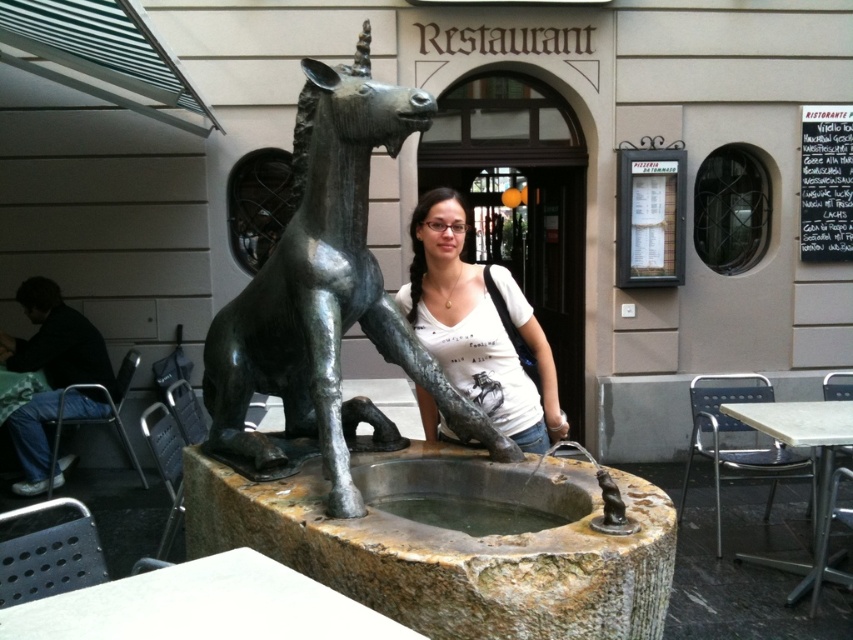
Question: Which point is closer to the camera?

Choices:
 (A) (445, 246)
 (B) (79, 408)

Answer: (A)

Question: Estimate the real-world distances between objects in this image. Which object is closer to the dark blue fabric at left?

Choices:
 (A) bronze unicorn at center
 (B) matte bronze unicorn at center

Answer: (A)

Question: Observing the image, what is the correct spatial positioning of bronze unicorn at center in reference to matte bronze unicorn at center?

Choices:
 (A) right
 (B) left

Answer: (B)

Question: Does matte bronze unicorn at center appear under dark blue fabric at left?

Choices:
 (A) no
 (B) yes

Answer: (A)

Question: Which object appears farthest from the camera in this image?

Choices:
 (A) matte bronze unicorn at center
 (B) bronze unicorn at center
 (C) dark blue fabric at left

Answer: (C)

Question: Can you confirm if matte bronze unicorn at center is smaller than dark blue fabric at left?

Choices:
 (A) yes
 (B) no

Answer: (A)